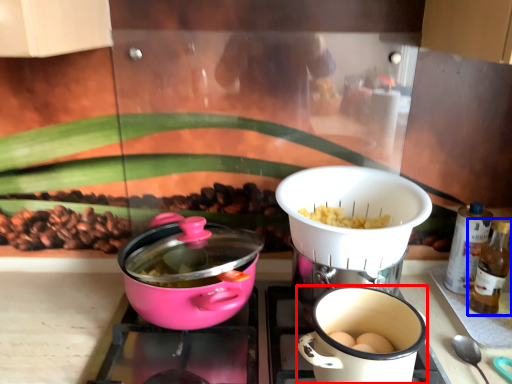
Question: Which point is closer to the camera, coffee cup (highlighted by a red box) or bottle (highlighted by a blue box)?

Choices:
 (A) coffee cup
 (B) bottle

Answer: (A)